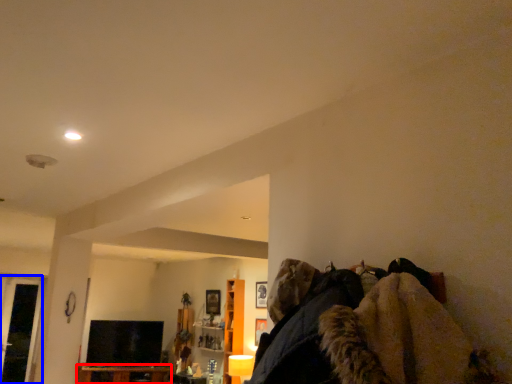
Question: Which point is closer to the camera, furniture (highlighted by a red box) or glass door (highlighted by a blue box)?

Choices:
 (A) furniture
 (B) glass door

Answer: (B)